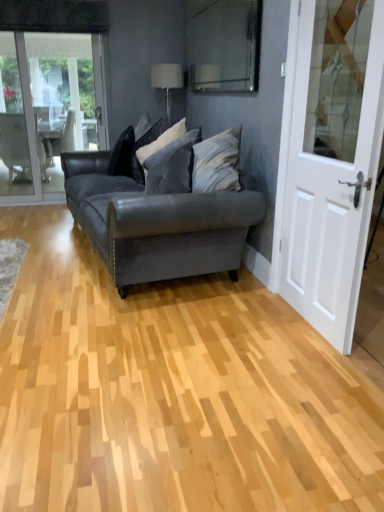
Describe the element at coordinates (225, 47) in the screenshot. I see `transparent glass window screen at upper center` at that location.

Where is `velvet gray pillow at center, which is counted as the first pillow, starting from the right`? The width and height of the screenshot is (384, 512). velvet gray pillow at center, which is counted as the first pillow, starting from the right is located at coordinates (172, 166).

The image size is (384, 512). Identify the location of white wooden door at right. (329, 164).

Is velvet black pillow at center, which ranks as the first pillow in left-to-right order, directly adjacent to white wooden door at right?

They are not placed beside each other.

Considering the points (126, 139) and (327, 211), which point is in front, point (126, 139) or point (327, 211)?

The point (327, 211) is more forward.

How far apart are velvet black pillow at center, the 3th pillow when ordered from right to left, and white wooden door at right?

They are 2.01 meters apart.

Considering the sizes of objects velvet black pillow at center, the 3th pillow when ordered from right to left, and white wooden door at right in the image provided, who is thinner, velvet black pillow at center, the 3th pillow when ordered from right to left, or white wooden door at right?

white wooden door at right.

Considering the sizes of objects velvet black pillow at center, which is the second pillow from left to right, and white wooden door at right in the image provided, who is bigger, velvet black pillow at center, which is the second pillow from left to right, or white wooden door at right?

With larger size is velvet black pillow at center, which is the second pillow from left to right.

Is velvet black pillow at center, which is the second pillow from left to right, looking in the opposite direction of white wooden door at right?

That's not correct — velvet black pillow at center, which is the second pillow from left to right, is not looking away from white wooden door at right.

Is velvet black pillow at center, the 2th pillow viewed from the right, at the left side of white wooden door at right?

Yes, velvet black pillow at center, the 2th pillow viewed from the right, is to the left of white wooden door at right.

Considering the positions of objects velvet black pillow at center, which is the second pillow from left to right, and white wooden door at right in the image provided, who is in front, velvet black pillow at center, which is the second pillow from left to right, or white wooden door at right?

Positioned in front is white wooden door at right.

Is white fabric lampshade at upper center touching velvet black pillow at center, the 3th pillow when ordered from right to left?

No, white fabric lampshade at upper center is not touching velvet black pillow at center, the 3th pillow when ordered from right to left.

Considering the positions of objects white fabric lampshade at upper center and velvet black pillow at center, which ranks as the first pillow in left-to-right order, in the image provided, who is more to the left, white fabric lampshade at upper center or velvet black pillow at center, which ranks as the first pillow in left-to-right order,?

velvet black pillow at center, which ranks as the first pillow in left-to-right order.

Is white fabric lampshade at upper center outside of velvet black pillow at center, the 3th pillow when ordered from right to left?

Yes, white fabric lampshade at upper center is located beyond the bounds of velvet black pillow at center, the 3th pillow when ordered from right to left.

From a real-world perspective, which object stands above the other?

white fabric lampshade at upper center is physically above.

Is white wooden door at right beside velvet gray pillow at center, the 3th pillow viewed from the left?

No, white wooden door at right is not beside velvet gray pillow at center, the 3th pillow viewed from the left.

Based on the photo, which is nearer, [341,146] or [162,161]?

Point [341,146] is positioned farther from the camera compared to point [162,161].

How many degrees apart are the facing directions of white wooden door at right and velvet gray pillow at center, the 3th pillow viewed from the left?

The facing directions of white wooden door at right and velvet gray pillow at center, the 3th pillow viewed from the left, are 10.1 degrees apart.

Between velvet gray pillow at center, which is counted as the first pillow, starting from the right, and white fabric lampshade at upper center, which one has smaller size?

white fabric lampshade at upper center is smaller.

From the image's perspective, which is below, velvet gray pillow at center, the 3th pillow viewed from the left, or white fabric lampshade at upper center?

velvet gray pillow at center, the 3th pillow viewed from the left, appears lower in the image.

Is velvet gray pillow at center, the 3th pillow viewed from the left, in front of or behind white fabric lampshade at upper center in the image?

Clearly, velvet gray pillow at center, the 3th pillow viewed from the left, is in front of white fabric lampshade at upper center.

Looking at this image, which object is wider, velvet gray pillow at center, the 3th pillow viewed from the left, or white fabric lampshade at upper center?

With larger width is velvet gray pillow at center, the 3th pillow viewed from the left.

Is matte black couch at center far away from velvet black pillow at center, the 3th pillow when ordered from right to left?

They are positioned close to each other.

Is matte black couch at center positioned behind velvet black pillow at center, the 3th pillow when ordered from right to left?

That is False.

From the picture: Would you say velvet black pillow at center, which ranks as the first pillow in left-to-right order, is part of matte black couch at center's contents?

Absolutely, velvet black pillow at center, which ranks as the first pillow in left-to-right order, is inside matte black couch at center.

Is matte black couch at center facing towards velvet black pillow at center, which ranks as the first pillow in left-to-right order?

No, matte black couch at center does not turn towards velvet black pillow at center, which ranks as the first pillow in left-to-right order.

From a real-world perspective, is transparent glass window screen at upper center physically located above or below matte black couch at center?

transparent glass window screen at upper center is above matte black couch at center.

Can you tell me how much transparent glass window screen at upper center and matte black couch at center differ in facing direction?

10.1 degrees.

Is point (217, 70) less distant than point (157, 201)?

No, it is not.

Which of these two, transparent glass window screen at upper center or matte black couch at center, is thinner?

Thinner between the two is transparent glass window screen at upper center.

This screenshot has height=512, width=384. I want to click on the 2nd pillow below the white wooden door at right (from a real-world perspective), so click(122, 154).

Locate an element on the screen. This screenshot has width=384, height=512. door above the velvet black pillow at center, the 2th pillow viewed from the right (from a real-world perspective) is located at coordinates (329, 164).

Based on their spatial positions, is white fabric lampshade at upper center or matte black couch at center closer to white wooden door at right?

The object closer to white wooden door at right is matte black couch at center.

When comparing their distances from white fabric lampshade at upper center, does transparent glass window screen at upper center or white wooden door at right seem closer?

Among the two, transparent glass window screen at upper center is located nearer to white fabric lampshade at upper center.

Which object lies further to the anchor point velvet black pillow at center, the 2th pillow viewed from the right, velvet gray pillow at center, which is counted as the first pillow, starting from the right, or white fabric lampshade at upper center?

white fabric lampshade at upper center lies further to velvet black pillow at center, the 2th pillow viewed from the right, than the other object.

Based on their spatial positions, is white wooden door at right or velvet gray pillow at center, which is counted as the first pillow, starting from the right, closer to velvet black pillow at center, which is the second pillow from left to right?

velvet gray pillow at center, which is counted as the first pillow, starting from the right, is closer to velvet black pillow at center, which is the second pillow from left to right.

Considering their positions, is transparent glass window screen at upper center positioned further to white wooden door at right than velvet gray pillow at center, the 3th pillow viewed from the left?

transparent glass window screen at upper center lies further to white wooden door at right than the other object.

Based on their spatial positions, is matte black couch at center or white fabric lampshade at upper center closer to velvet black pillow at center, which is the second pillow from left to right?

matte black couch at center is positioned closer to the anchor velvet black pillow at center, which is the second pillow from left to right.

Estimate the real-world distances between objects in this image. Which object is closer to white fabric lampshade at upper center, matte black couch at center or transparent glass window screen at upper center?

Based on the image, transparent glass window screen at upper center appears to be nearer to white fabric lampshade at upper center.

From the image, which object appears to be farther from velvet gray pillow at center, the 3th pillow viewed from the left, matte black couch at center or velvet black pillow at center, which ranks as the first pillow in left-to-right order?

velvet black pillow at center, which ranks as the first pillow in left-to-right order, is further to velvet gray pillow at center, the 3th pillow viewed from the left.

The height and width of the screenshot is (512, 384). I want to click on studio couch between transparent glass window screen at upper center and white wooden door at right in the vertical direction, so click(157, 222).

You are a GUI agent. You are given a task and a screenshot of the screen. Output one action in this format:
    pyautogui.click(x=<x>, y=<y>)
    Task: Click on the window screen between white wooden door at right and velvet gray pillow at center, the 3th pillow viewed from the left, along the z-axis
    
    Given the screenshot: What is the action you would take?
    pyautogui.click(x=225, y=47)

This screenshot has width=384, height=512. What are the coordinates of `studio couch between white wooden door at right and velvet black pillow at center, which ranks as the first pillow in left-to-right order, along the z-axis` in the screenshot? It's located at (157, 222).

Where is `window screen between matte black couch at center and white fabric lampshade at upper center in the front-back direction`? window screen between matte black couch at center and white fabric lampshade at upper center in the front-back direction is located at coordinates coord(225,47).